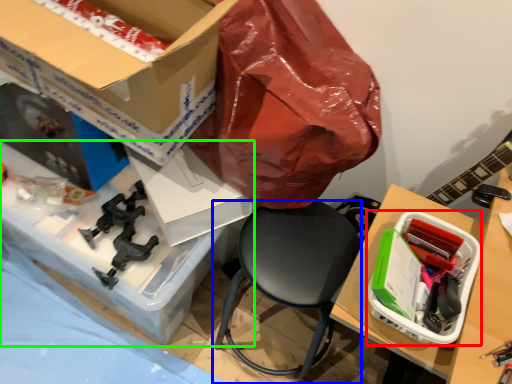
Question: Which is farther away from box (highlighted by a red box)? chair (highlighted by a blue box) or desk (highlighted by a green box)?

Choices:
 (A) chair
 (B) desk

Answer: (B)